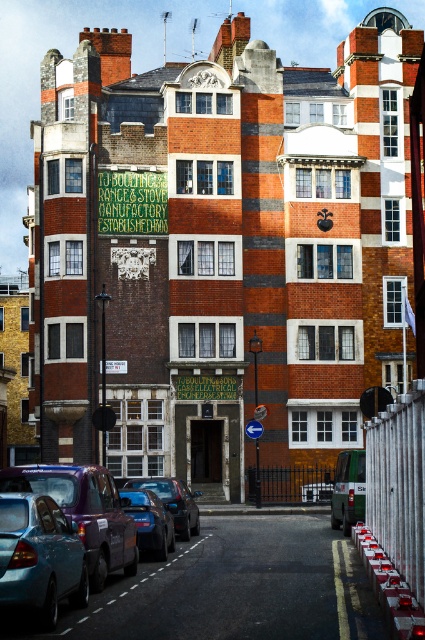
You are a pedestrian standing on the sidewalk observing the street scene. You see a matte blue car at lower left and a metallic blue car at center. Which car is positioned closer to the left side of the street?

The matte blue car at lower left is positioned closer to the left side of the street because it is to the left of the metallic blue car at center.

You are a delivery driver who needs to park your truck between the matte blue car at lower left and the metallic blue car at center. The truck is 15 meters long. Can you fit your truck between them without overlapping either car?

The distance between the matte blue car at lower left and the metallic blue car at center is 14.53 meters. Since the truck is 15 meters long, it cannot fit between them without overlapping either car.